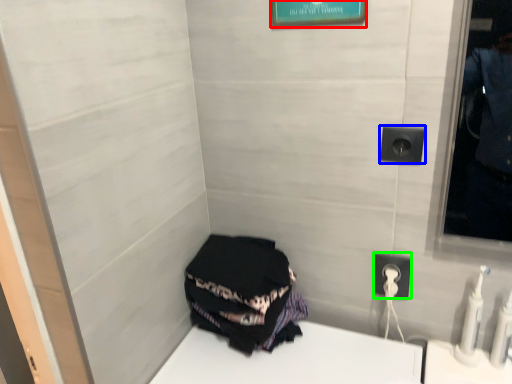
Question: Considering the real-world distances, which object is closest to picture frame (highlighted by a red box)? electric outlet (highlighted by a blue box) or power outlet (highlighted by a green box).

Choices:
 (A) electric outlet
 (B) power outlet

Answer: (A)